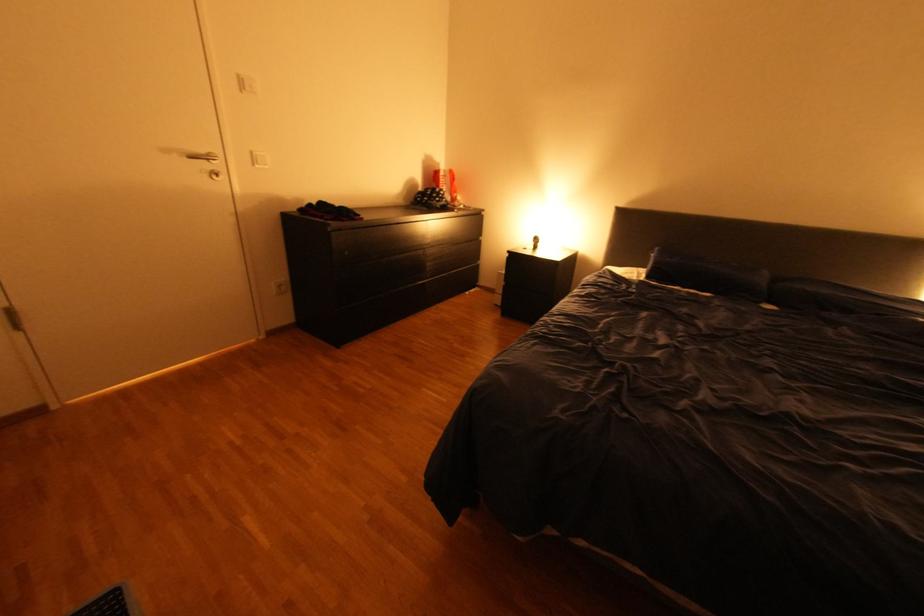
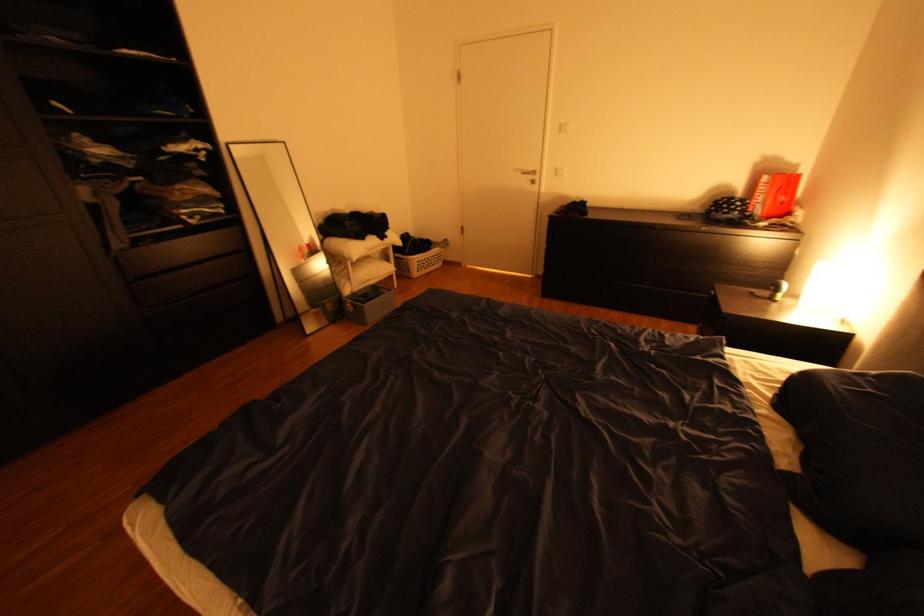
In the second image, find the point that corresponds to pixel 264 161 in the first image.

(565, 174)